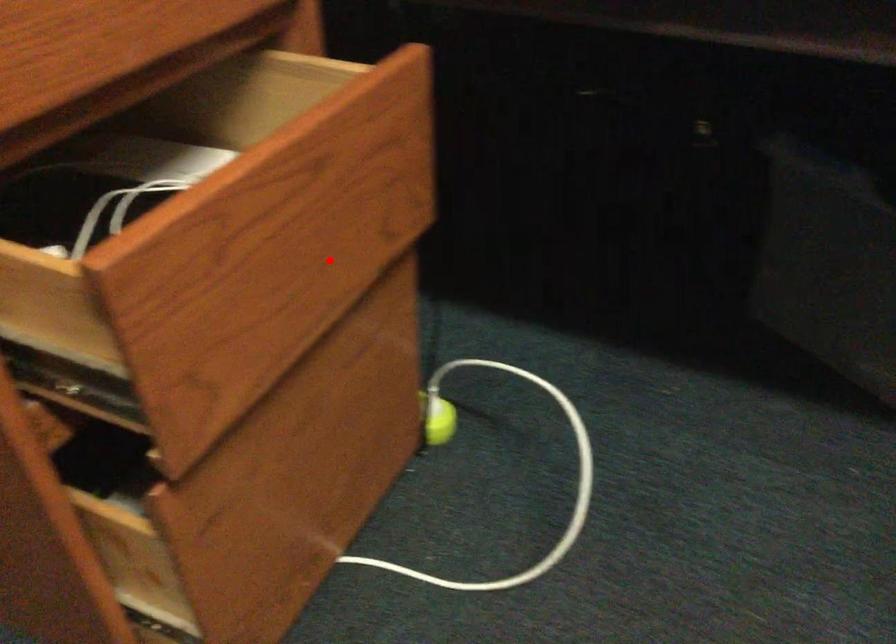
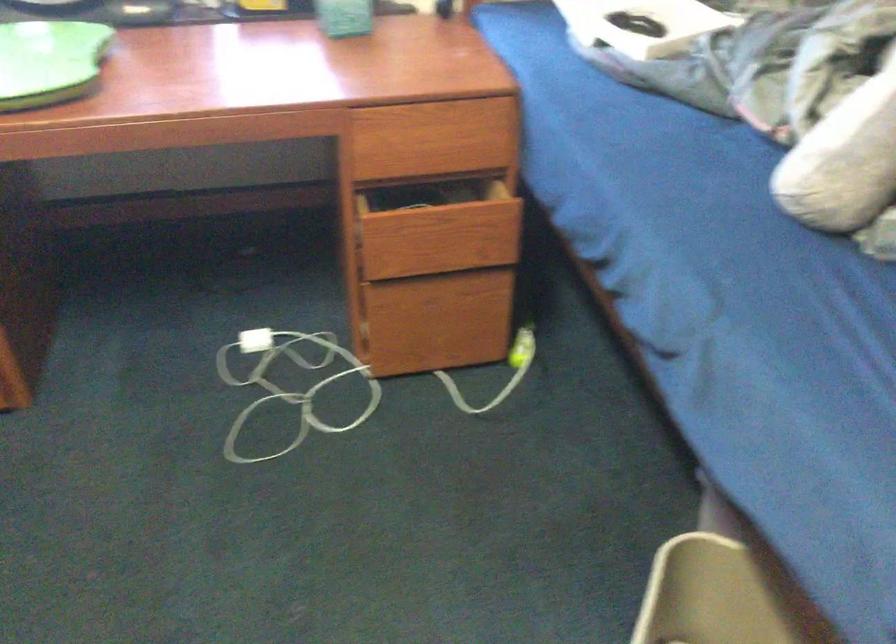
Question: I am providing you with two images of the same scene from different viewpoints. In image1, a red point is highlighted. Considering the same 3D point in image2, which of the following is correct?

Choices:
 (A) It is closer
 (B) It is farther

Answer: (B)